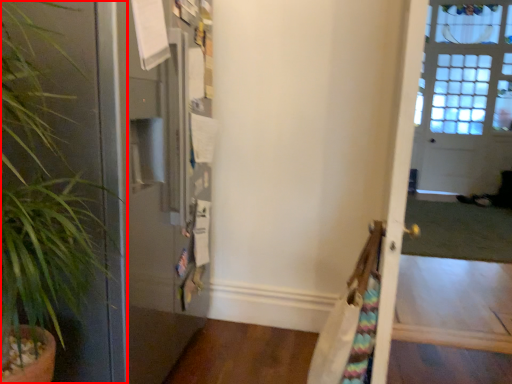
Question: Observing the image, what is the correct spatial positioning of houseplant (annotated by the red box) in reference to screen door?

Choices:
 (A) left
 (B) right

Answer: (A)